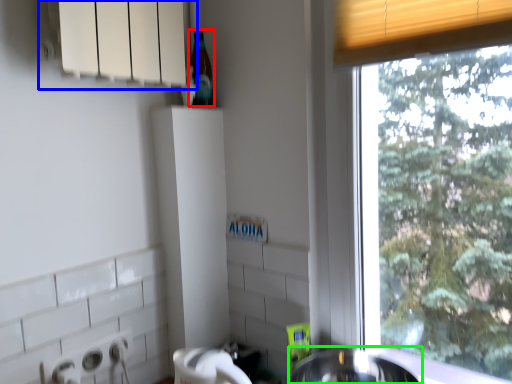
Question: Which object is the closest to the bottle (highlighted by a red box)? Choose among these: window sill (highlighted by a blue box) or sink (highlighted by a green box).

Choices:
 (A) window sill
 (B) sink

Answer: (A)